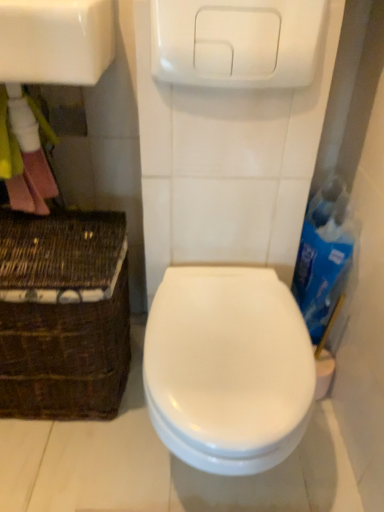
Question: Should I look upward or downward to see white glossy sink at upper left?

Choices:
 (A) up
 (B) down

Answer: (A)

Question: Is white glossy sink at upper left thinner than brown woven basket at lower left?

Choices:
 (A) no
 (B) yes

Answer: (B)

Question: Is white glossy sink at upper left touching brown woven basket at lower left?

Choices:
 (A) no
 (B) yes

Answer: (A)

Question: Does white glossy sink at upper left have a greater width compared to brown woven basket at lower left?

Choices:
 (A) yes
 (B) no

Answer: (B)

Question: From the image's perspective, is white glossy sink at upper left located beneath brown woven basket at lower left?

Choices:
 (A) no
 (B) yes

Answer: (A)

Question: Can you confirm if white glossy sink at upper left is taller than brown woven basket at lower left?

Choices:
 (A) no
 (B) yes

Answer: (A)

Question: Can you confirm if white glossy sink at upper left is smaller than brown woven basket at lower left?

Choices:
 (A) no
 (B) yes

Answer: (B)

Question: Can you confirm if brown woven basket at lower left is shorter than white glossy toilet at center?

Choices:
 (A) yes
 (B) no

Answer: (B)

Question: Is brown woven basket at lower left at the right side of white glossy toilet at center?

Choices:
 (A) no
 (B) yes

Answer: (A)

Question: Can you confirm if brown woven basket at lower left is positioned to the left of white glossy toilet at center?

Choices:
 (A) no
 (B) yes

Answer: (B)

Question: Can you confirm if brown woven basket at lower left is wider than white glossy toilet at center?

Choices:
 (A) no
 (B) yes

Answer: (A)

Question: Is brown woven basket at lower left not inside white glossy toilet at center?

Choices:
 (A) no
 (B) yes

Answer: (B)

Question: Is brown woven basket at lower left turned away from white glossy toilet at center?

Choices:
 (A) no
 (B) yes

Answer: (A)

Question: Is white glossy sink at upper left taller than white glossy toilet at center?

Choices:
 (A) yes
 (B) no

Answer: (B)